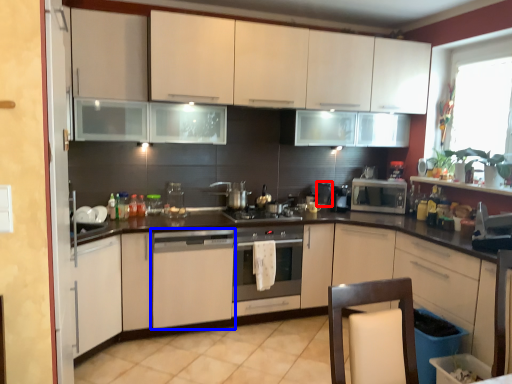
Question: Among these objects, which one is farthest to the camera, appliance (highlighted by a red box) or home appliance (highlighted by a blue box)?

Choices:
 (A) appliance
 (B) home appliance

Answer: (A)